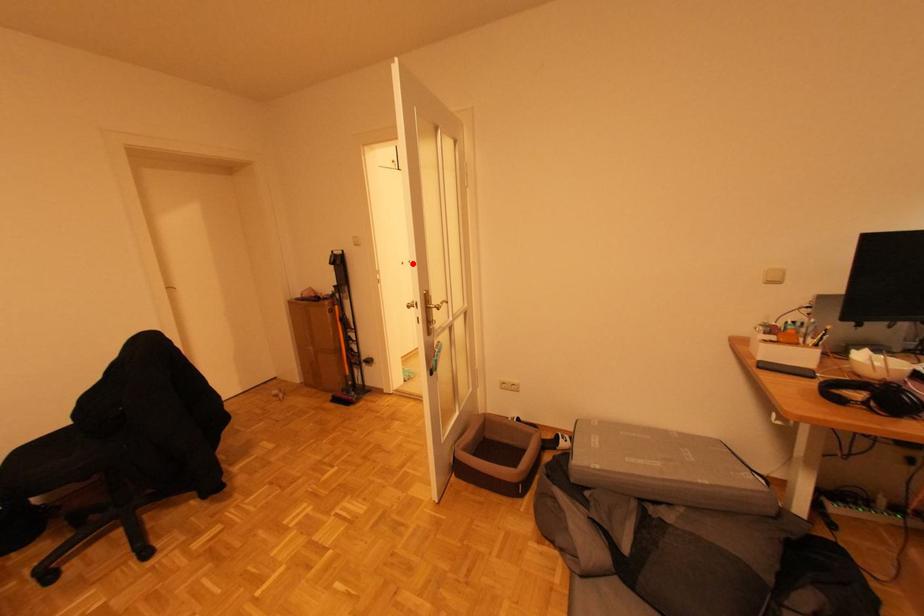
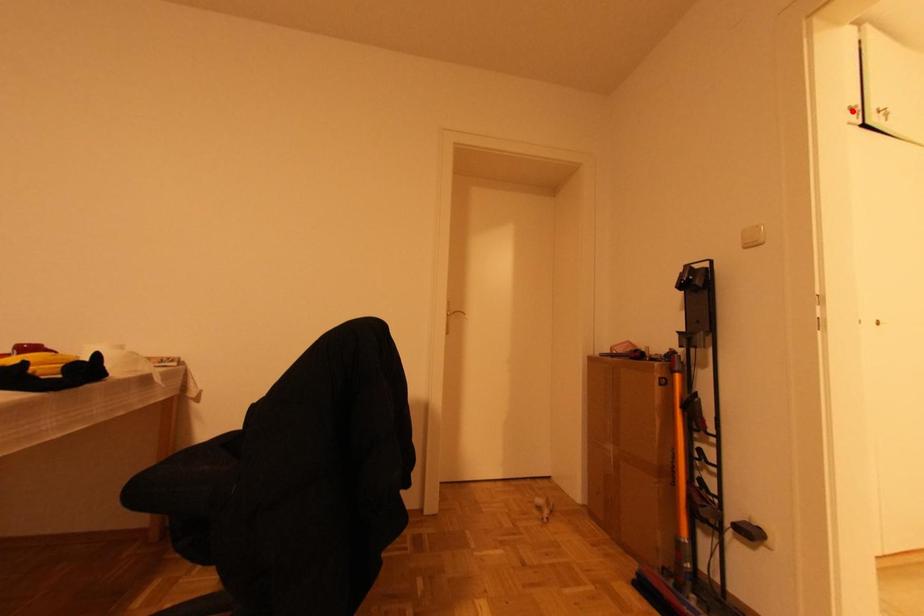
I am providing you with two images of the same scene from different viewpoints. A red point is marked on the first image and another point is marked on the second image. Does the point marked in image1 correspond to the same location as the one in image2?

No